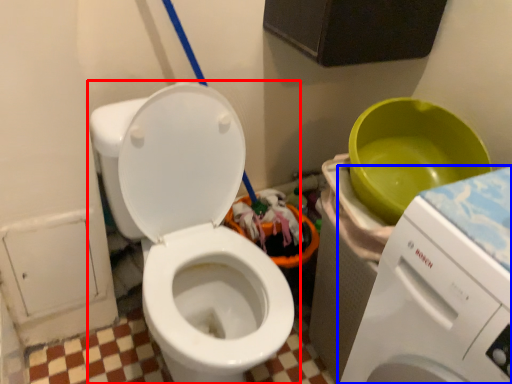
Question: Which of the following is the farthest to the observer, toilet (highlighted by a red box) or washing machine (highlighted by a blue box)?

Choices:
 (A) toilet
 (B) washing machine

Answer: (A)